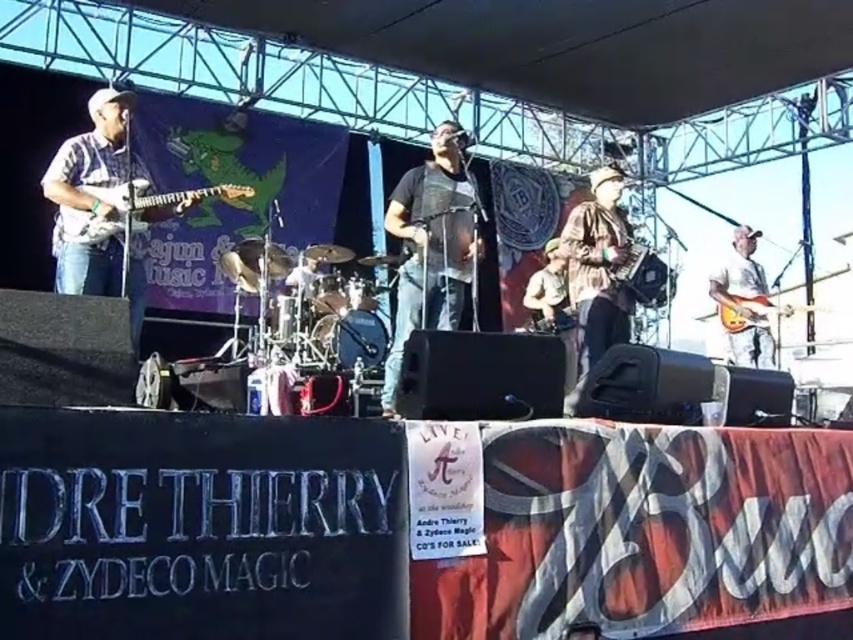
You are a photographer at the concert and want to capture a closeup of the black mesh vest at center and the matte black electric guitar at left. Which object should you zoom in on to ensure it appears larger in your photo?

The matte black electric guitar at left is thicker than the black mesh vest at center, so zooming in on it will make it appear larger in the photo.

You are a photographer positioned at the front row of the concert. You want to take a photo focusing on the black mesh vest at center and the matte black electric guitar at left. Based on their positions, which object will appear larger in your photo?

The black mesh vest at center is closer to the viewer than the matte black electric guitar at left, so it will appear larger in the photo.

You are a stagehand at the Ajun and Zydeco Music Festival. You need to retrieve the white matte guitar at right from the stage. The stage is crowded with performers and equipment. Based on its coordinates, can you estimate where to look for it?

The white matte guitar at right is located at point coordinates 0.472 on the x axis and 0.871 on the y axis, so you should look towards the right side of the stage, closer to the bottom edge to find it.